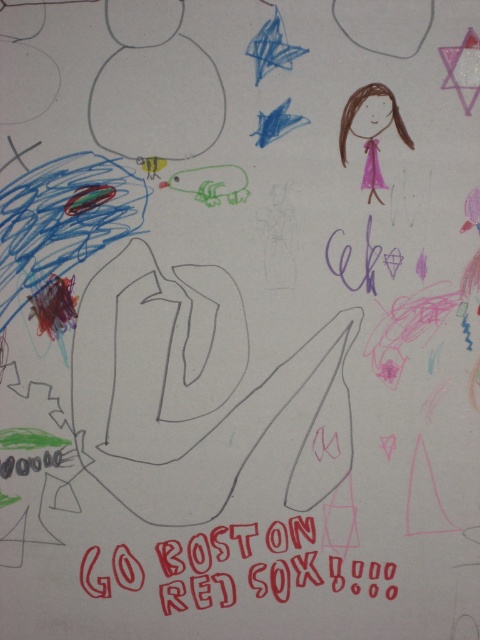
Does red paper text at center appear over pink paper doll at upper right?

Incorrect, red paper text at center is not positioned above pink paper doll at upper right.

Who is higher up, red paper text at center or pink paper doll at upper right?

pink paper doll at upper right is above.

Image resolution: width=480 pixels, height=640 pixels. Find the location of `red paper text at center`. red paper text at center is located at coordinates (259, 564).

This screenshot has width=480, height=640. Find the location of `red paper text at center`. red paper text at center is located at coordinates (259, 564).